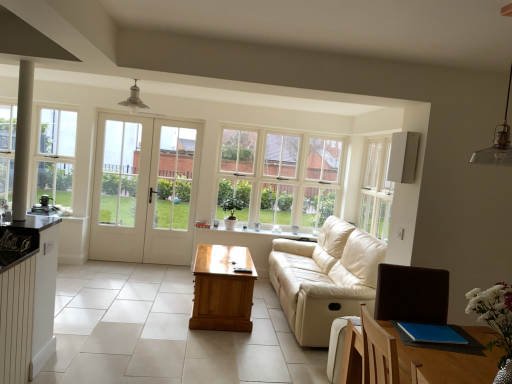
Question: Does white glass door at center appear on the right side of matte black coffee machine at left, marked as the 2th appliance in a front-to-back arrangement?

Choices:
 (A) yes
 (B) no

Answer: (A)

Question: Can you confirm if white glass door at center is smaller than matte black coffee machine at left, marked as the 2th appliance in a front-to-back arrangement?

Choices:
 (A) yes
 (B) no

Answer: (B)

Question: Is white glass door at center closer to camera compared to matte black coffee machine at left, marked as the first appliance in a bottom-to-top arrangement?

Choices:
 (A) no
 (B) yes

Answer: (A)

Question: From the image's perspective, would you say white glass door at center is positioned over matte black coffee machine at left, marked as the 2th appliance in a front-to-back arrangement?

Choices:
 (A) no
 (B) yes

Answer: (B)

Question: Is white glass door at center behind matte black coffee machine at left, acting as the 1th appliance starting from the left?

Choices:
 (A) yes
 (B) no

Answer: (A)

Question: In terms of height, does light brown wooden table at center look taller or shorter compared to beige leather couch at center?

Choices:
 (A) tall
 (B) short

Answer: (B)

Question: From a real-world perspective, relative to beige leather couch at center, is light brown wooden table at center vertically above or below?

Choices:
 (A) below
 (B) above

Answer: (A)

Question: In terms of width, does light brown wooden table at center look wider or thinner when compared to beige leather couch at center?

Choices:
 (A) thin
 (B) wide

Answer: (A)

Question: Does point (232, 284) appear closer or farther from the camera than point (317, 258)?

Choices:
 (A) farther
 (B) closer

Answer: (B)

Question: Which is correct: beige leather couch at center is inside clear glass window at left, which ranks as the 2th window in right-to-left order, or outside of it?

Choices:
 (A) outside
 (B) inside

Answer: (A)

Question: In terms of size, does beige leather couch at center appear bigger or smaller than clear glass window at left, the first window viewed from the left?

Choices:
 (A) small
 (B) big

Answer: (B)

Question: Is beige leather couch at center to the left or to the right of clear glass window at left, which ranks as the 2th window in right-to-left order, in the image?

Choices:
 (A) right
 (B) left

Answer: (A)

Question: From a real-world perspective, is beige leather couch at center physically located above or below clear glass window at left, marked as the first window in a front-to-back arrangement?

Choices:
 (A) above
 (B) below

Answer: (B)

Question: Looking at the image, does clear glass window at center, which ranks as the first window in back-to-front order, seem bigger or smaller compared to light brown wooden table at center?

Choices:
 (A) big
 (B) small

Answer: (B)

Question: Looking at their shapes, would you say clear glass window at center, arranged as the second window when viewed from the front, is wider or thinner than light brown wooden table at center?

Choices:
 (A) wide
 (B) thin

Answer: (B)